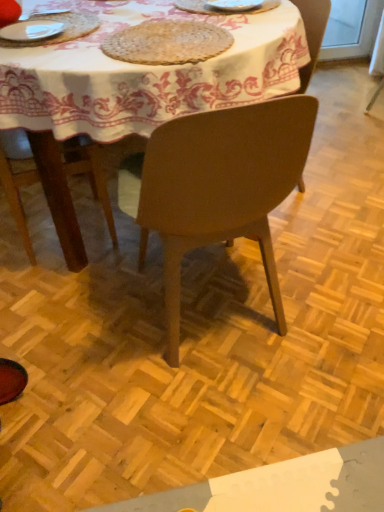
Where is `free space to the left of woven natural fiber mat at upper center`? This screenshot has width=384, height=512. free space to the left of woven natural fiber mat at upper center is located at coordinates (68, 51).